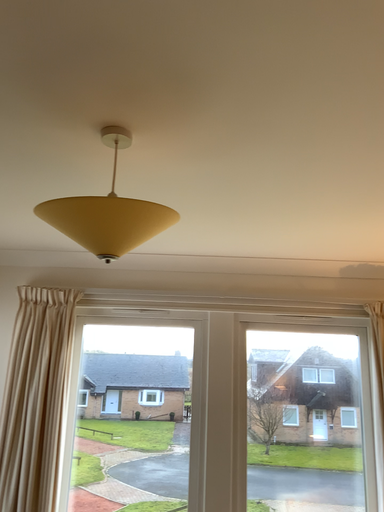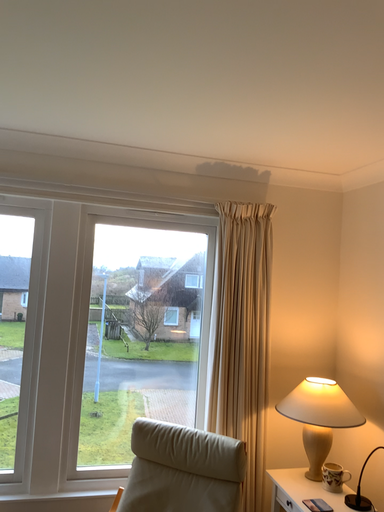
Question: Which way did the camera rotate in the video?

Choices:
 (A) rotated right
 (B) rotated left

Answer: (A)